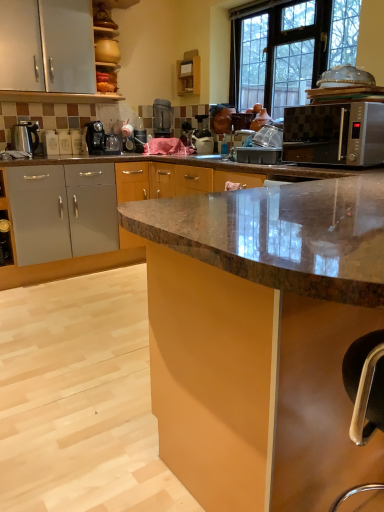
The width and height of the screenshot is (384, 512). Identify the location of metallic silver kettle at left. (25, 137).

The image size is (384, 512). Describe the element at coordinates (334, 134) in the screenshot. I see `satin silver microwave at right` at that location.

In order to face satin silver microwave at right, should I rotate leftwards or rightwards?

You should look right and rotate roughly 19.330 degrees.

Describe the element at coordinates (261, 336) in the screenshot. The image size is (384, 512). I see `matte brown cabinet at center, which ranks as the 1th cabinetry in right-to-left order` at that location.

Identify the location of wooden shelf at upper center, the second cabinetry viewed from the right. (189, 73).

What is the approximate width of wooden shelf at upper center, the 1th cabinetry in the top-to-bottom sequence?

wooden shelf at upper center, the 1th cabinetry in the top-to-bottom sequence, is 9.05 centimeters wide.

Image resolution: width=384 pixels, height=512 pixels. Find the location of `satin black coffee machine at center, arranged as the second coffee machine when viewed from the back`. satin black coffee machine at center, arranged as the second coffee machine when viewed from the back is located at coordinates (101, 140).

Identify the location of transparent glass window at upper center. The height and width of the screenshot is (512, 384). (288, 42).

What's the angular difference between wooden shelf at upper center, positioned as the 2th cabinetry in bottom-to-top order, and satin black coffee machine at center, placed as the first coffee machine when sorted from left to right,'s facing directions?

The angular difference between wooden shelf at upper center, positioned as the 2th cabinetry in bottom-to-top order, and satin black coffee machine at center, placed as the first coffee machine when sorted from left to right, is 89.7 degrees.

Based on the photo, is wooden shelf at upper center, placed as the 1th cabinetry when sorted from left to right, oriented away from satin black coffee machine at center, which appears as the first coffee machine when viewed from the front?

That's not correct — wooden shelf at upper center, placed as the 1th cabinetry when sorted from left to right, is not looking away from satin black coffee machine at center, which appears as the first coffee machine when viewed from the front.

Is wooden shelf at upper center, positioned as the 2th cabinetry in bottom-to-top order, shorter than satin black coffee machine at center, arranged as the second coffee machine when viewed from the back?

Incorrect, the height of wooden shelf at upper center, positioned as the 2th cabinetry in bottom-to-top order, does not fall short of that of satin black coffee machine at center, arranged as the second coffee machine when viewed from the back.

Considering the sizes of objects wooden shelf at upper center, positioned as the 2th cabinetry in bottom-to-top order, and metallic silver kettle at left in the image provided, who is shorter, wooden shelf at upper center, positioned as the 2th cabinetry in bottom-to-top order, or metallic silver kettle at left?

metallic silver kettle at left is shorter.

What's the angular difference between wooden shelf at upper center, the second cabinetry viewed from the right, and metallic silver kettle at left's facing directions?

89.3 degrees separate the facing orientations of wooden shelf at upper center, the second cabinetry viewed from the right, and metallic silver kettle at left.

Is wooden shelf at upper center, the first cabinetry viewed from the back, smaller than metallic silver kettle at left?

Actually, wooden shelf at upper center, the first cabinetry viewed from the back, might be larger than metallic silver kettle at left.

From the image's perspective, is wooden shelf at upper center, the 2th cabinetry viewed from the front, positioned above or below metallic silver kettle at left?

wooden shelf at upper center, the 2th cabinetry viewed from the front, is situated higher than metallic silver kettle at left in the image.

Would you say satin black coffee machine at center, the 2th coffee machine when ordered from left to right, is a long distance from matte brown cabinet at center, which ranks as the 1th cabinetry in right-to-left order?

satin black coffee machine at center, the 2th coffee machine when ordered from left to right, is positioned a significant distance from matte brown cabinet at center, which ranks as the 1th cabinetry in right-to-left order.

Is satin black coffee machine at center, which ranks as the 2th coffee machine in front-to-back order, aimed at matte brown cabinet at center, the first cabinetry from the front?

No, satin black coffee machine at center, which ranks as the 2th coffee machine in front-to-back order, is not turned towards matte brown cabinet at center, the first cabinetry from the front.

Considering the sizes of satin black coffee machine at center, marked as the first coffee machine in a right-to-left arrangement, and matte brown cabinet at center, which is the first cabinetry from bottom to top, in the image, is satin black coffee machine at center, marked as the first coffee machine in a right-to-left arrangement, taller or shorter than matte brown cabinet at center, which is the first cabinetry from bottom to top,?

Clearly, satin black coffee machine at center, marked as the first coffee machine in a right-to-left arrangement, is shorter compared to matte brown cabinet at center, which is the first cabinetry from bottom to top.

From the image's perspective, between satin black coffee machine at center, positioned as the first coffee machine in back-to-front order, and matte brown cabinet at center, which is the first cabinetry from bottom to top, who is located below?

matte brown cabinet at center, which is the first cabinetry from bottom to top, is shown below in the image.

Is point (326, 245) positioned after point (38, 135)?

No.

Looking at this image, considering the positions of objects matte brown cabinet at center, the second cabinetry in the top-to-bottom sequence, and metallic silver kettle at left in the image provided, who is more to the left, matte brown cabinet at center, the second cabinetry in the top-to-bottom sequence, or metallic silver kettle at left?

metallic silver kettle at left.

Is satin silver microwave at right aimed at metallic silver kettle at left?

No.

Consider the image. Is satin silver microwave at right spatially inside metallic silver kettle at left, or outside of it?

satin silver microwave at right is outside metallic silver kettle at left.

Can you confirm if satin silver microwave at right is wider than metallic silver kettle at left?

Indeed, satin silver microwave at right has a greater width compared to metallic silver kettle at left.

Based on the photo, is the depth of satin silver microwave at right less than that of metallic silver kettle at left?

Yes, it is in front of metallic silver kettle at left.

Who is taller, wooden shelf at upper center, the first cabinetry viewed from the back, or transparent glass window at upper center?

transparent glass window at upper center is taller.

Is wooden shelf at upper center, the second cabinetry viewed from the right, turned away from transparent glass window at upper center?

No, wooden shelf at upper center, the second cabinetry viewed from the right,'s orientation is not away from transparent glass window at upper center.

Who is smaller, wooden shelf at upper center, positioned as the 2th cabinetry in bottom-to-top order, or transparent glass window at upper center?

Smaller between the two is wooden shelf at upper center, positioned as the 2th cabinetry in bottom-to-top order.

Between point (177, 73) and point (254, 78), which one is positioned in front?

The point (254, 78) is closer.

Considering the sizes of objects satin black coffee machine at center, the 2th coffee machine in the right-to-left sequence, and metallic silver kettle at left in the image provided, who is shorter, satin black coffee machine at center, the 2th coffee machine in the right-to-left sequence, or metallic silver kettle at left?

Standing shorter between the two is metallic silver kettle at left.

Can metallic silver kettle at left be found inside satin black coffee machine at center, the 2th coffee machine in the right-to-left sequence?

No, metallic silver kettle at left is not surrounded by satin black coffee machine at center, the 2th coffee machine in the right-to-left sequence.

In terms of size, does satin black coffee machine at center, which appears as the first coffee machine when viewed from the front, appear bigger or smaller than metallic silver kettle at left?

Considering their sizes, satin black coffee machine at center, which appears as the first coffee machine when viewed from the front, takes up more space than metallic silver kettle at left.

Which object is positioned more to the right, satin black coffee machine at center, which appears as the first coffee machine when viewed from the front, or metallic silver kettle at left?

From the viewer's perspective, satin black coffee machine at center, which appears as the first coffee machine when viewed from the front, appears more on the right side.

At what (x,y) coordinates should I click in order to perform the action: click on cabinetry located behind the satin black coffee machine at center, the 2th coffee machine in the right-to-left sequence. Please return your answer as a coordinate pair (x, y). This screenshot has height=512, width=384. Looking at the image, I should click on (189, 73).

This screenshot has height=512, width=384. I want to click on appliance lying on the left of wooden shelf at upper center, the first cabinetry viewed from the back, so click(x=25, y=137).

Which object lies nearer to the anchor point wooden shelf at upper center, the 1th cabinetry in the top-to-bottom sequence, satin silver microwave at right or matte brown cabinet at center, the second cabinetry in the top-to-bottom sequence?

Based on the image, satin silver microwave at right appears to be nearer to wooden shelf at upper center, the 1th cabinetry in the top-to-bottom sequence.

Estimate the real-world distances between objects in this image. Which object is closer to matte brown cabinet at center, the first cabinetry from the front, satin black coffee machine at center, positioned as the first coffee machine in back-to-front order, or wooden shelf at upper center, placed as the 1th cabinetry when sorted from left to right?

Among the two, satin black coffee machine at center, positioned as the first coffee machine in back-to-front order, is located nearer to matte brown cabinet at center, the first cabinetry from the front.

Estimate the real-world distances between objects in this image. Which object is closer to satin black coffee machine at center, the 2th coffee machine when ordered from left to right, satin silver microwave at right or satin black coffee machine at center, the 2th coffee machine in the right-to-left sequence?

satin black coffee machine at center, the 2th coffee machine in the right-to-left sequence, lies closer to satin black coffee machine at center, the 2th coffee machine when ordered from left to right, than the other object.

Based on their spatial positions, is metallic silver kettle at left or satin black coffee machine at center, positioned as the first coffee machine in back-to-front order, further from wooden shelf at upper center, the second cabinetry viewed from the right?

metallic silver kettle at left lies further to wooden shelf at upper center, the second cabinetry viewed from the right, than the other object.

Which object lies nearer to the anchor point satin silver microwave at right, metallic silver kettle at left or transparent glass window at upper center?

transparent glass window at upper center is closer to satin silver microwave at right.

Based on their spatial positions, is satin silver microwave at right or wooden shelf at upper center, the second cabinetry viewed from the right, closer to matte brown cabinet at center, which ranks as the 1th cabinetry in right-to-left order?

satin silver microwave at right is closer to matte brown cabinet at center, which ranks as the 1th cabinetry in right-to-left order.

Based on their spatial positions, is satin black coffee machine at center, the 2th coffee machine in the right-to-left sequence, or transparent glass window at upper center closer to metallic silver kettle at left?

Based on the image, satin black coffee machine at center, the 2th coffee machine in the right-to-left sequence, appears to be nearer to metallic silver kettle at left.

Based on their spatial positions, is matte brown cabinet at center, which is the first cabinetry from bottom to top, or satin black coffee machine at center, the 2th coffee machine in the right-to-left sequence, further from satin black coffee machine at center, the 2th coffee machine when ordered from left to right?

matte brown cabinet at center, which is the first cabinetry from bottom to top, is positioned further to the anchor satin black coffee machine at center, the 2th coffee machine when ordered from left to right.

Find the location of `microwave oven located between matte brown cabinet at center, which ranks as the 1th cabinetry in right-to-left order, and wooden shelf at upper center, the first cabinetry viewed from the back, in the depth direction`. microwave oven located between matte brown cabinet at center, which ranks as the 1th cabinetry in right-to-left order, and wooden shelf at upper center, the first cabinetry viewed from the back, in the depth direction is located at coordinates (334, 134).

You are a GUI agent. You are given a task and a screenshot of the screen. Output one action in this format:
    pyautogui.click(x=<x>, y=<y>)
    Task: Click on the cabinetry positioned between satin silver microwave at right and satin black coffee machine at center, which ranks as the 2th coffee machine in front-to-back order, from near to far
    The height and width of the screenshot is (512, 384).
    Given the screenshot: What is the action you would take?
    pyautogui.click(x=189, y=73)

The image size is (384, 512). I want to click on coffee machine between satin silver microwave at right and satin black coffee machine at center, marked as the first coffee machine in a right-to-left arrangement, in the front-back direction, so click(x=101, y=140).

What are the coordinates of `window situated between metallic silver kettle at left and satin silver microwave at right from left to right` in the screenshot? It's located at (288, 42).